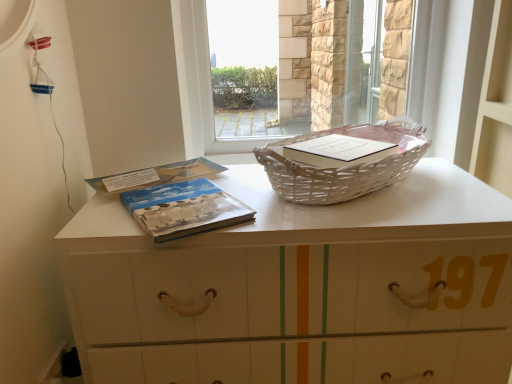
This screenshot has height=384, width=512. Describe the element at coordinates (343, 167) in the screenshot. I see `white wicker picnic basket at center` at that location.

Describe the element at coordinates (184, 209) in the screenshot. I see `matte blue cover book at center, the first paperback book positioned from the front` at that location.

What is the approximate width of transparent plastic basket at upper center?

It is 4.33 inches.

This screenshot has width=512, height=384. Describe the element at coordinates (165, 174) in the screenshot. I see `blue matte book at center, the second paperback book when ordered from front to back` at that location.

This screenshot has height=384, width=512. What are the coordinates of `blue matte book at center, which is counted as the first paperback book, starting from the back` in the screenshot? It's located at (165, 174).

Locate an element on the screen. The image size is (512, 384). white wicker basket at upper center is located at coordinates (300, 287).

Image resolution: width=512 pixels, height=384 pixels. What do you see at coordinates (300, 287) in the screenshot?
I see `white wicker basket at upper center` at bounding box center [300, 287].

The height and width of the screenshot is (384, 512). In order to click on white wicker picnic basket at center in this screenshot , I will do `click(343, 167)`.

Is matte blue cover book at center, which is counted as the second paperback book, starting from the back, positioned in front of white wicker basket at upper center?

No, matte blue cover book at center, which is counted as the second paperback book, starting from the back, is behind white wicker basket at upper center.

Is white wicker basket at upper center at the back of matte blue cover book at center, which is counted as the second paperback book, starting from the back?

Result: matte blue cover book at center, which is counted as the second paperback book, starting from the back, does not have its back to white wicker basket at upper center.

From a real-world perspective, does matte blue cover book at center, the first paperback book positioned from the front, stand above white wicker basket at upper center?

Indeed, from a real-world perspective, matte blue cover book at center, the first paperback book positioned from the front, stands above white wicker basket at upper center.

Considering the relative sizes of matte blue cover book at center, the first paperback book positioned from the front, and transparent plastic basket at upper center in the image provided, is matte blue cover book at center, the first paperback book positioned from the front, shorter than transparent plastic basket at upper center?

Yes.

From a real-world perspective, which paperback book is the 1st one underneath the transparent plastic basket at upper center? Please provide its 2D coordinates.

[(184, 209)]

Is matte blue cover book at center, the first paperback book positioned from the front, wider than transparent plastic basket at upper center?

Correct, the width of matte blue cover book at center, the first paperback book positioned from the front, exceeds that of transparent plastic basket at upper center.

From the image's perspective, which object appears higher, matte blue cover book at center, the first paperback book positioned from the front, or transparent plastic basket at upper center?

transparent plastic basket at upper center.

Is transparent plastic basket at upper center not within blue matte book at center, the second paperback book when ordered from front to back?

That's correct, transparent plastic basket at upper center is outside of blue matte book at center, the second paperback book when ordered from front to back.

In the image, is transparent plastic basket at upper center positioned in front of or behind blue matte book at center, which is counted as the first paperback book, starting from the back?

transparent plastic basket at upper center is behind blue matte book at center, which is counted as the first paperback book, starting from the back.

From a real-world perspective, which is physically below, transparent plastic basket at upper center or blue matte book at center, the second paperback book when ordered from front to back?

In real-world perspective, blue matte book at center, the second paperback book when ordered from front to back, is lower.

Starting from the transparent plastic basket at upper center, which paperback book is the 1st one in front? Please provide its 2D coordinates.

[(165, 174)]

Would you say matte blue cover book at center, the first paperback book positioned from the front, is part of white wicker basket at upper center's contents?

That's correct, matte blue cover book at center, the first paperback book positioned from the front, is inside white wicker basket at upper center.

Which of these two, white wicker basket at upper center or matte blue cover book at center, the first paperback book positioned from the front, is wider?

white wicker basket at upper center.

Considering the positions of objects white wicker basket at upper center and matte blue cover book at center, the first paperback book positioned from the front, in the image provided, who is more to the left, white wicker basket at upper center or matte blue cover book at center, the first paperback book positioned from the front,?

Positioned to the left is matte blue cover book at center, the first paperback book positioned from the front.

Is white wicker basket at upper center with white wicker picnic basket at center?

No, white wicker basket at upper center is not touching white wicker picnic basket at center.

Is white wicker picnic basket at center at the back of white wicker basket at upper center?

No.

From the picture: What's the angular difference between white wicker basket at upper center and white wicker picnic basket at center's facing directions?

They differ by 0.00013 degrees in their facing directions.

Considering the relative positions of white wicker basket at upper center and white wicker picnic basket at center in the image provided, is white wicker basket at upper center to the left or to the right of white wicker picnic basket at center?

A: Based on their positions, white wicker basket at upper center is located to the left of white wicker picnic basket at center.

How far apart are white wicker picnic basket at center and blue matte book at center, which is counted as the first paperback book, starting from the back?

white wicker picnic basket at center is 37.47 centimeters from blue matte book at center, which is counted as the first paperback book, starting from the back.

Looking at this image, is the position of white wicker picnic basket at center less distant than that of blue matte book at center, which is counted as the first paperback book, starting from the back?

Yes, the depth of white wicker picnic basket at center is less than that of blue matte book at center, which is counted as the first paperback book, starting from the back.

Considering the relative sizes of white wicker picnic basket at center and blue matte book at center, the second paperback book when ordered from front to back, in the image provided, is white wicker picnic basket at center taller than blue matte book at center, the second paperback book when ordered from front to back,?

Yes, white wicker picnic basket at center is taller than blue matte book at center, the second paperback book when ordered from front to back.

In the scene shown: Between white wicker picnic basket at center and blue matte book at center, which is counted as the first paperback book, starting from the back, which one has smaller width?

blue matte book at center, which is counted as the first paperback book, starting from the back.

At what (x,y) coordinates should I click in order to perform the action: click on picnic basket that is on the right side of matte blue cover book at center, the first paperback book positioned from the front. Please return your answer as a coordinate pair (x, y). This screenshot has width=512, height=384. Looking at the image, I should click on (343, 167).

From a real-world perspective, is white wicker picnic basket at center above or below matte blue cover book at center, which is counted as the second paperback book, starting from the back?

From a real-world perspective, white wicker picnic basket at center is physically above matte blue cover book at center, which is counted as the second paperback book, starting from the back.

Are white wicker picnic basket at center and matte blue cover book at center, which is counted as the second paperback book, starting from the back, located far from each other?

white wicker picnic basket at center is actually quite close to matte blue cover book at center, which is counted as the second paperback book, starting from the back.

Is white wicker picnic basket at center inside or outside of matte blue cover book at center, the first paperback book positioned from the front?

white wicker picnic basket at center is not inside matte blue cover book at center, the first paperback book positioned from the front, it's outside.

The height and width of the screenshot is (384, 512). I want to click on the 1st paperback book to the left of the white wicker basket at upper center, counting from the anchor's position, so click(x=184, y=209).

Find the location of a particular element. Image resolution: width=512 pixels, height=384 pixels. window that appears on the right of matte blue cover book at center, which is counted as the second paperback book, starting from the back is located at coordinates (200, 84).

Estimate the real-world distances between objects in this image. Which object is further from white wicker picnic basket at center, white wicker basket at upper center or transparent plastic basket at upper center?

transparent plastic basket at upper center is positioned further to the anchor white wicker picnic basket at center.

From the image, which object appears to be nearer to matte blue cover book at center, which is counted as the second paperback book, starting from the back, blue matte book at center, the second paperback book when ordered from front to back, or transparent plastic basket at upper center?

Among the two, blue matte book at center, the second paperback book when ordered from front to back, is located nearer to matte blue cover book at center, which is counted as the second paperback book, starting from the back.

Looking at the image, which one is located further to blue matte book at center, which is counted as the first paperback book, starting from the back, white wicker picnic basket at center or matte blue cover book at center, the first paperback book positioned from the front?

white wicker picnic basket at center is positioned further to the anchor blue matte book at center, which is counted as the first paperback book, starting from the back.

Estimate the real-world distances between objects in this image. Which object is further from blue matte book at center, the second paperback book when ordered from front to back, matte blue cover book at center, which is counted as the second paperback book, starting from the back, or white wicker picnic basket at center?

white wicker picnic basket at center is further to blue matte book at center, the second paperback book when ordered from front to back.

Considering their positions, is blue matte book at center, the second paperback book when ordered from front to back, positioned further to transparent plastic basket at upper center than matte blue cover book at center, the first paperback book positioned from the front?

matte blue cover book at center, the first paperback book positioned from the front.

Considering their positions, is matte blue cover book at center, which is counted as the second paperback book, starting from the back, positioned further to white wicker basket at upper center than blue matte book at center, which is counted as the first paperback book, starting from the back?

blue matte book at center, which is counted as the first paperback book, starting from the back, lies further to white wicker basket at upper center than the other object.

Estimate the real-world distances between objects in this image. Which object is closer to transparent plastic basket at upper center, white wicker basket at upper center or blue matte book at center, the second paperback book when ordered from front to back?

blue matte book at center, the second paperback book when ordered from front to back.

When comparing their distances from blue matte book at center, the second paperback book when ordered from front to back, does white wicker basket at upper center or transparent plastic basket at upper center seem closer?

Among the two, transparent plastic basket at upper center is located nearer to blue matte book at center, the second paperback book when ordered from front to back.

Locate an element on the screen. picnic basket between matte blue cover book at center, which is counted as the second paperback book, starting from the back, and transparent plastic basket at upper center, along the z-axis is located at coordinates (343, 167).

Find the location of a particular element. This screenshot has width=512, height=384. paperback book between blue matte book at center, which is counted as the first paperback book, starting from the back, and white wicker basket at upper center in the up-down direction is located at coordinates (184, 209).

The image size is (512, 384). Identify the location of paperback book between blue matte book at center, the second paperback book when ordered from front to back, and white wicker picnic basket at center. (184, 209).

Identify the location of paperback book positioned between matte blue cover book at center, the first paperback book positioned from the front, and transparent plastic basket at upper center from near to far. (165, 174).